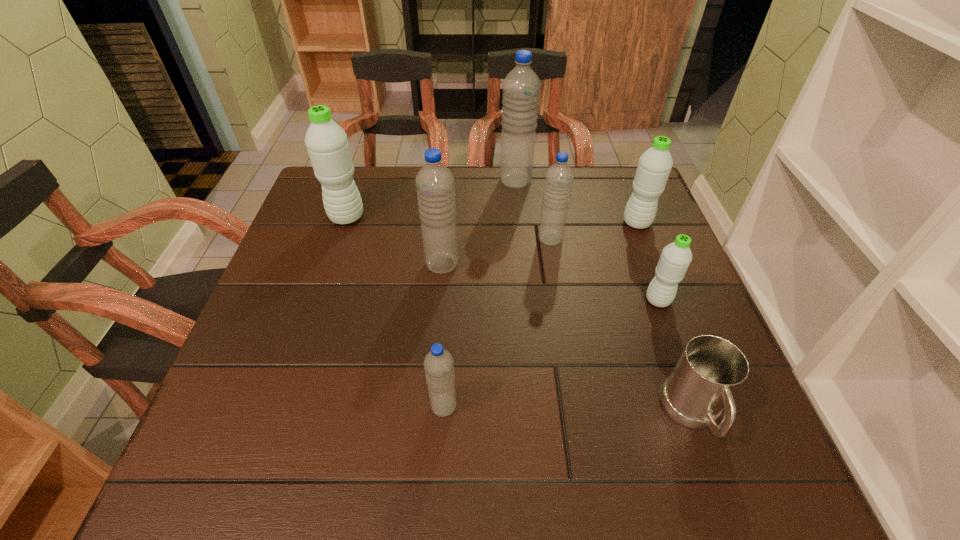
Where is `the nearest water bottle`? Image resolution: width=960 pixels, height=540 pixels. the nearest water bottle is located at coordinates (438, 363).

I want to click on the nearest blue water bottle, so click(438, 363).

The height and width of the screenshot is (540, 960). What are the coordinates of `gray mug` in the screenshot? It's located at (710, 370).

The width and height of the screenshot is (960, 540). What are the coordinates of `the shortest object` in the screenshot? It's located at (710, 370).

This screenshot has height=540, width=960. In order to click on free space located 0.090m on the front of the tallest object in this screenshot , I will do `click(518, 210)`.

Find the location of `free space located 0.320m on the front of the leftmost water bottle`. free space located 0.320m on the front of the leftmost water bottle is located at coordinates (310, 327).

Locate an element on the screen. The image size is (960, 540). free location located on the back of the second biggest blue water bottle is located at coordinates (444, 234).

Find the location of `vacant area located 0.330m on the front of the second smallest green water bottle`. vacant area located 0.330m on the front of the second smallest green water bottle is located at coordinates (681, 336).

I want to click on vacant region located 0.300m on the front of the second smallest blue water bottle, so click(568, 348).

This screenshot has width=960, height=540. I want to click on blank space located on the back of the second nearest water bottle, so click(x=646, y=268).